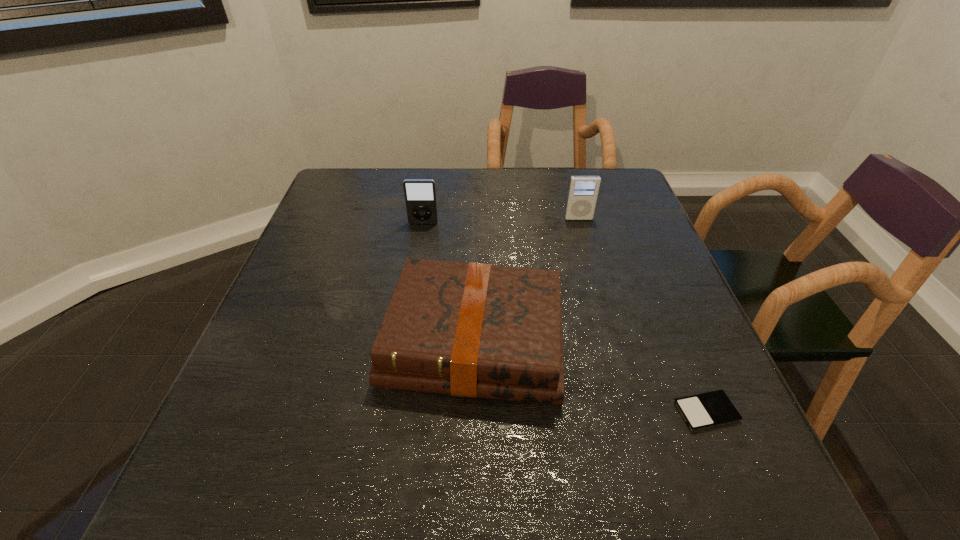
You are a GUI agent. You are given a task and a screenshot of the screen. Output one action in this format:
    pyautogui.click(x=<x>, y=<y>)
    Task: Click on the leftmost iPod
    
    Given the screenshot: What is the action you would take?
    pyautogui.click(x=420, y=194)

Where is `the second nearest iPod`? The image size is (960, 540). the second nearest iPod is located at coordinates (420, 194).

The image size is (960, 540). I want to click on the farthest object, so point(583,190).

The image size is (960, 540). I want to click on the second object from right to left, so click(583, 190).

Locate an element on the screen. The image size is (960, 540). the third tallest object is located at coordinates (473, 330).

This screenshot has height=540, width=960. I want to click on the shortest object, so click(706, 410).

In order to click on the rightmost iPod in this screenshot , I will do `click(706, 410)`.

Find the location of `free point located on the front-facing side of the leftmost iPod`. free point located on the front-facing side of the leftmost iPod is located at coordinates (408, 322).

Find the location of a particular element. This screenshot has height=540, width=960. vacant region located 0.220m on the front-facing side of the third object from left to right is located at coordinates tap(594, 275).

You are a GUI agent. You are given a task and a screenshot of the screen. Output one action in this format:
    pyautogui.click(x=<x>, y=<y>)
    Task: Click on the free location located on the back of the second shortest object
    This screenshot has width=960, height=540.
    Given the screenshot: What is the action you would take?
    pyautogui.click(x=475, y=214)